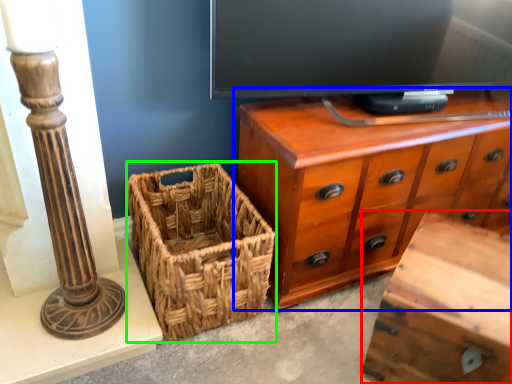
Question: Which object is positioned farthest from vanity (highlighted by a red box)? Select from chest of drawers (highlighted by a blue box) and picnic basket (highlighted by a green box).

Choices:
 (A) chest of drawers
 (B) picnic basket

Answer: (B)